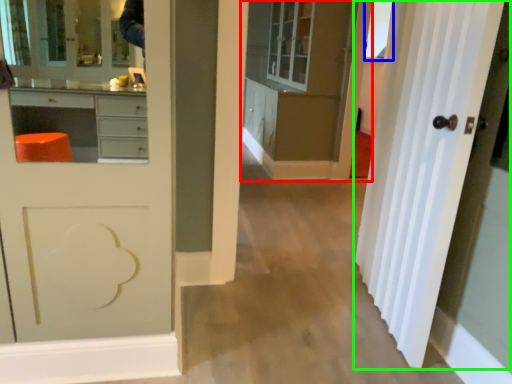
Question: Which object is positioned farthest from cabinetry (highlighted by a red box)? Select from window (highlighted by a blue box) and door (highlighted by a green box).

Choices:
 (A) window
 (B) door

Answer: (B)